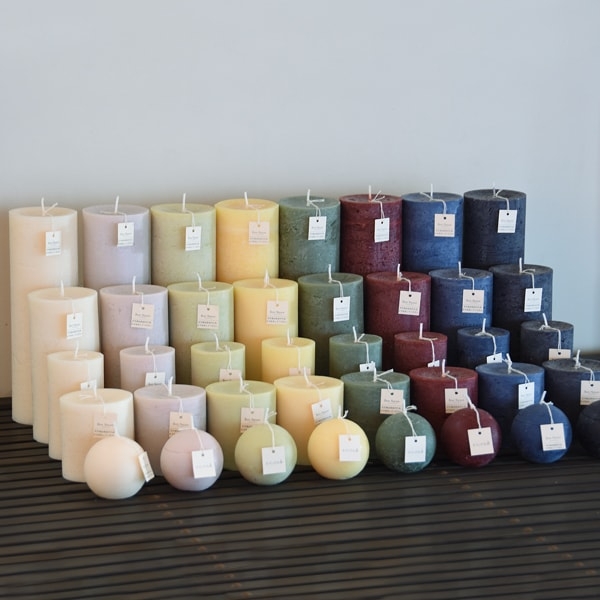
Image resolution: width=600 pixels, height=600 pixels. Find the location of `sphere candles in front row`. sphere candles in front row is located at coordinates (114, 463), (182, 460), (250, 453), (325, 449), (390, 442), (457, 435), (529, 429), (592, 421).